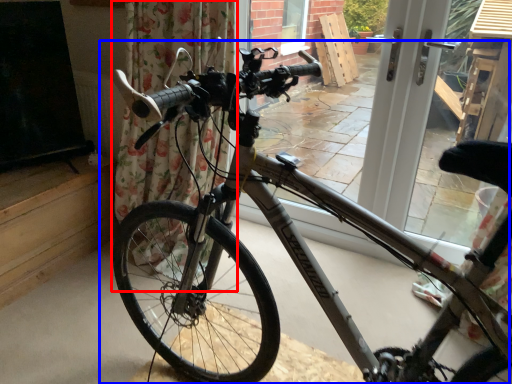
Question: Which of the following is the farthest to the observer, curtain (highlighted by a red box) or bicycle (highlighted by a blue box)?

Choices:
 (A) curtain
 (B) bicycle

Answer: (A)